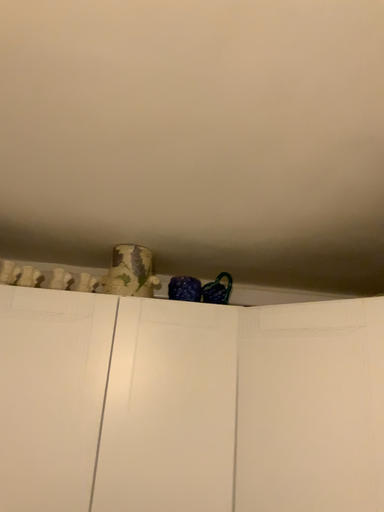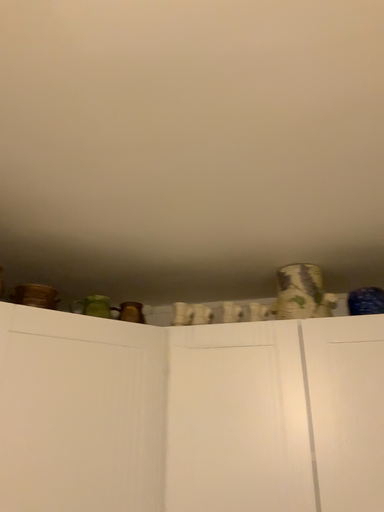
Question: How did the camera likely rotate when shooting the video?

Choices:
 (A) rotated left
 (B) rotated right

Answer: (A)